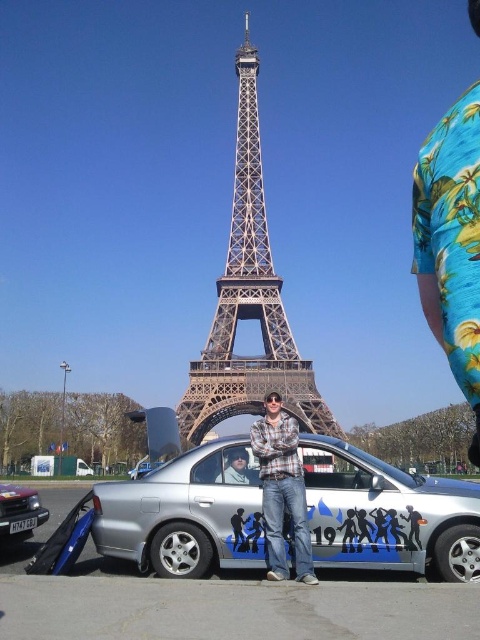
Is shiny black car at lower left bigger than silver metallic sedan at center?

Indeed, shiny black car at lower left has a larger size compared to silver metallic sedan at center.

Does point (23, 531) lie behind point (131, 477)?

No.

Where is `shiny black car at lower left`? The height and width of the screenshot is (640, 480). shiny black car at lower left is located at coordinates (19, 513).

Does shiny black car at lower left appear under matte black jacket at center?

Indeed, shiny black car at lower left is positioned under matte black jacket at center.

Does shiny black car at lower left have a lesser height compared to matte black jacket at center?

No, shiny black car at lower left is not shorter than matte black jacket at center.

Who is more forward, [21,528] or [238,461]?

Positioned in front is point [238,461].

Locate an element on the screen. shiny black car at lower left is located at coordinates (19, 513).

Which is above, metallic silver tower at center or shiny black car at lower left?

metallic silver tower at center is above.

Is metallic silver tower at center to the right of shiny black car at lower left from the viewer's perspective?

Indeed, metallic silver tower at center is positioned on the right side of shiny black car at lower left.

What do you see at coordinates (249, 301) in the screenshot? I see `metallic silver tower at center` at bounding box center [249, 301].

Locate an element on the screen. Image resolution: width=480 pixels, height=640 pixels. metallic silver tower at center is located at coordinates (249, 301).